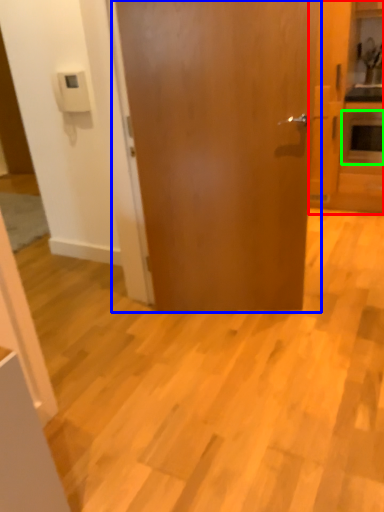
Question: Estimate the real-world distances between objects in this image. Which object is farther from cabinetry (highlighted by a red box), door (highlighted by a blue box) or appliance (highlighted by a green box)?

Choices:
 (A) door
 (B) appliance

Answer: (A)